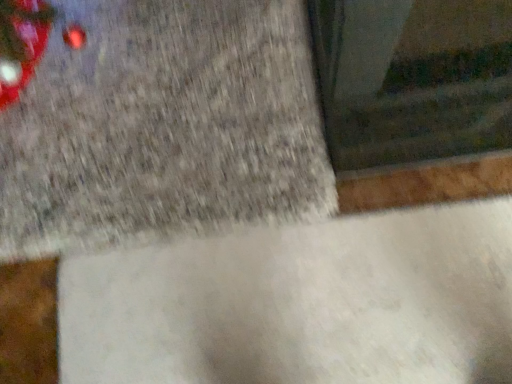
Where is `vacant area that lies in front of gray concrete at upper left, the second concrete ordered from the bottom`? vacant area that lies in front of gray concrete at upper left, the second concrete ordered from the bottom is located at coordinates (298, 284).